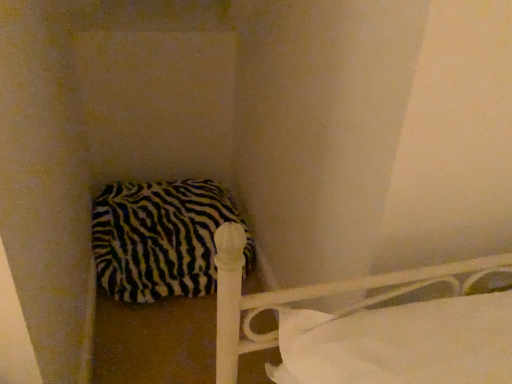
I want to click on zebra-patterned fabric pillow at lower left, so click(x=161, y=238).

This screenshot has width=512, height=384. What do you see at coordinates (161, 238) in the screenshot? I see `zebra-patterned fabric pillow at lower left` at bounding box center [161, 238].

Where is `zebra-patterned fabric pillow at lower left`? Image resolution: width=512 pixels, height=384 pixels. zebra-patterned fabric pillow at lower left is located at coordinates (161, 238).